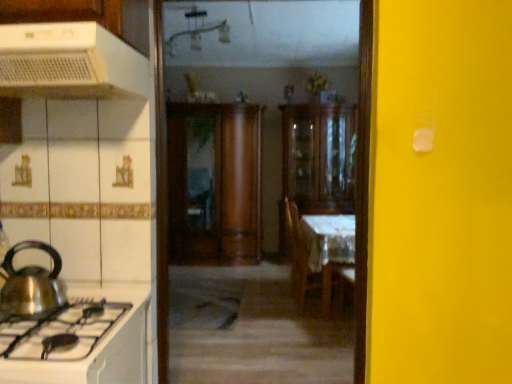
Question: Is shiny metallic kettle at left, marked as the second kitchen appliance in a top-to-bottom arrangement, smaller than wooden cabinet at center, the first cabinetry in the left-to-right sequence?

Choices:
 (A) no
 (B) yes

Answer: (B)

Question: Considering the relative sizes of shiny metallic kettle at left, the first kitchen appliance when ordered from bottom to top, and wooden cabinet at center, the second cabinetry in the right-to-left sequence, in the image provided, is shiny metallic kettle at left, the first kitchen appliance when ordered from bottom to top, bigger than wooden cabinet at center, the second cabinetry in the right-to-left sequence,?

Choices:
 (A) yes
 (B) no

Answer: (B)

Question: From the image's perspective, would you say shiny metallic kettle at left, marked as the second kitchen appliance in a top-to-bottom arrangement, is positioned over wooden cabinet at center, the first cabinetry in the left-to-right sequence?

Choices:
 (A) yes
 (B) no

Answer: (B)

Question: Does shiny metallic kettle at left, the first kitchen appliance when ordered from bottom to top, have a greater width compared to wooden cabinet at center, the first cabinetry in the left-to-right sequence?

Choices:
 (A) no
 (B) yes

Answer: (A)

Question: From a real-world perspective, is shiny metallic kettle at left, the first kitchen appliance when ordered from bottom to top, on wooden cabinet at center, the first cabinetry in the left-to-right sequence?

Choices:
 (A) yes
 (B) no

Answer: (B)

Question: Is shiny metallic kettle at left, the first kitchen appliance when ordered from bottom to top, surrounding wooden cabinet at center, the first cabinetry in the left-to-right sequence?

Choices:
 (A) yes
 (B) no

Answer: (B)

Question: Is wooden cabinet at center, marked as the 1th cabinetry in a right-to-left arrangement, outside of white plastic range hood at upper left, marked as the first kitchen appliance in a top-to-bottom arrangement?

Choices:
 (A) no
 (B) yes

Answer: (B)

Question: Considering the relative sizes of wooden cabinet at center, marked as the 1th cabinetry in a right-to-left arrangement, and white plastic range hood at upper left, the 2th kitchen appliance positioned from the bottom, in the image provided, is wooden cabinet at center, marked as the 1th cabinetry in a right-to-left arrangement, thinner than white plastic range hood at upper left, the 2th kitchen appliance positioned from the bottom,?

Choices:
 (A) no
 (B) yes

Answer: (A)

Question: Can you confirm if wooden cabinet at center, marked as the 1th cabinetry in a right-to-left arrangement, is shorter than white plastic range hood at upper left, marked as the first kitchen appliance in a top-to-bottom arrangement?

Choices:
 (A) no
 (B) yes

Answer: (A)

Question: Does wooden cabinet at center, which ranks as the second cabinetry in left-to-right order, lie in front of white plastic range hood at upper left, marked as the first kitchen appliance in a top-to-bottom arrangement?

Choices:
 (A) yes
 (B) no

Answer: (B)

Question: Considering the relative positions of wooden cabinet at center, which ranks as the second cabinetry in left-to-right order, and white plastic range hood at upper left, the 2th kitchen appliance positioned from the bottom, in the image provided, is wooden cabinet at center, which ranks as the second cabinetry in left-to-right order, to the right of white plastic range hood at upper left, the 2th kitchen appliance positioned from the bottom, from the viewer's perspective?

Choices:
 (A) no
 (B) yes

Answer: (B)

Question: Does wooden cabinet at center, marked as the 1th cabinetry in a right-to-left arrangement, have a smaller size compared to white plastic range hood at upper left, the 2th kitchen appliance positioned from the bottom?

Choices:
 (A) yes
 (B) no

Answer: (B)

Question: Can you confirm if shiny metallic kettle at left, marked as the second kitchen appliance in a top-to-bottom arrangement, is bigger than wooden chair at center?

Choices:
 (A) yes
 (B) no

Answer: (B)